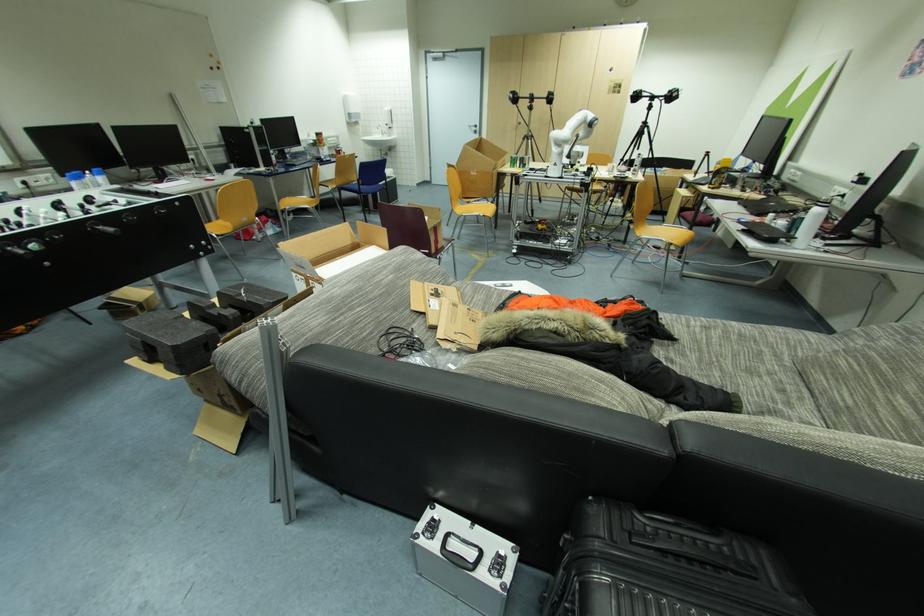
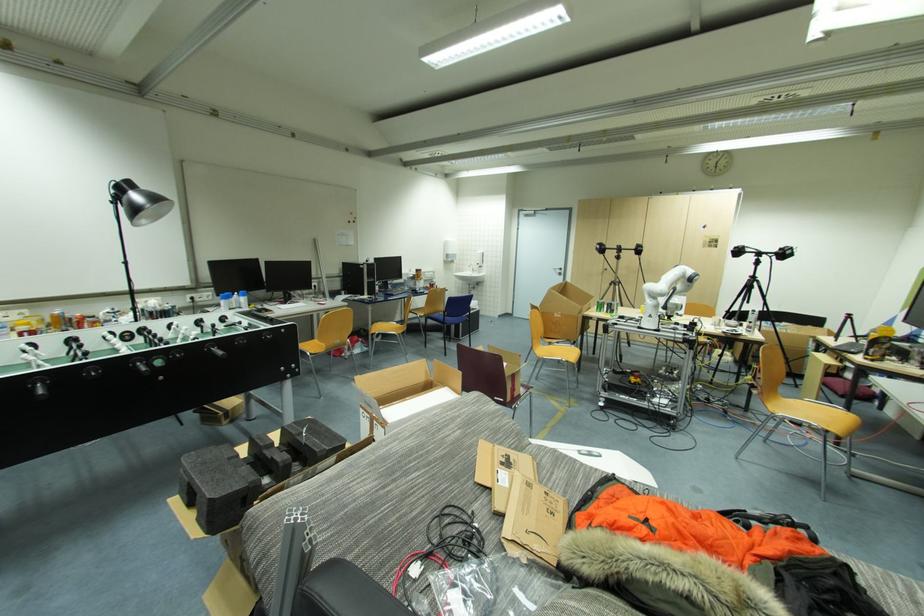
In the second image, find the point that corresponds to point (223, 233) in the first image.

(315, 353)